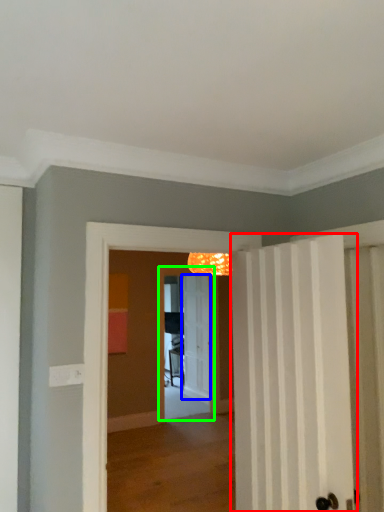
Question: Which is nearer to the door (highlighted by a red box)? door (highlighted by a blue box) or screen door (highlighted by a green box).

Choices:
 (A) door
 (B) screen door

Answer: (B)